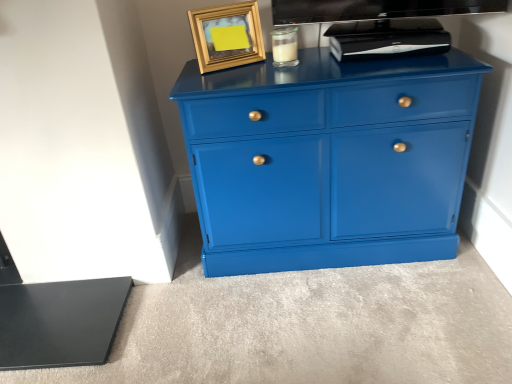
The width and height of the screenshot is (512, 384). What are the coordinates of `free space that is in between gold metallic picture frame at upper center and clear glass jar at upper center` in the screenshot? It's located at (248, 68).